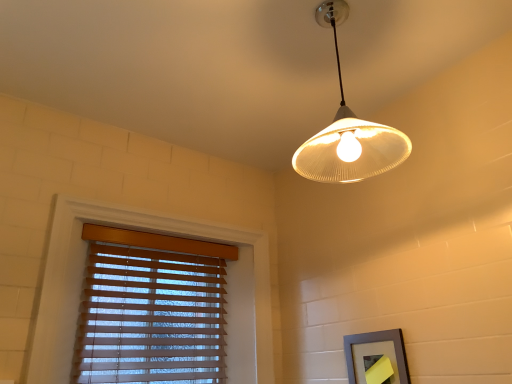
Question: In terms of width, does wooden blinds at lower left look wider or thinner when compared to gray matte picture frame at lower right?

Choices:
 (A) thin
 (B) wide

Answer: (B)

Question: From a real-world perspective, relative to gray matte picture frame at lower right, is wooden blinds at lower left vertically above or below?

Choices:
 (A) above
 (B) below

Answer: (A)

Question: Which is nearer to the wooden blinds at lower left?

Choices:
 (A) white ribbed glass lampshade at upper center
 (B) gray matte picture frame at lower right

Answer: (B)

Question: Which of these objects is positioned closest to the gray matte picture frame at lower right?

Choices:
 (A) white ribbed glass lampshade at upper center
 (B) wooden blinds at lower left

Answer: (A)